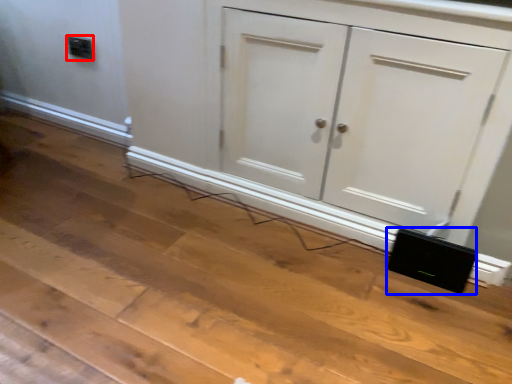
Question: Among these objects, which one is nearest to the camera, electric outlet (highlighted by a red box) or speaker (highlighted by a blue box)?

Choices:
 (A) electric outlet
 (B) speaker

Answer: (B)